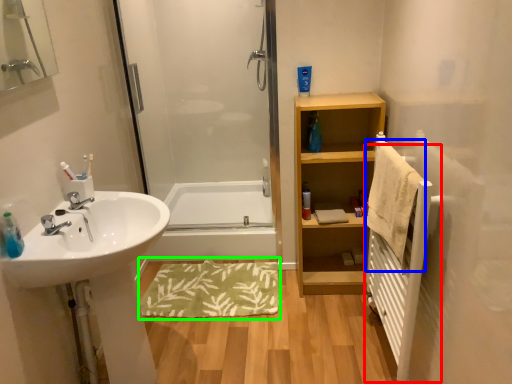
Question: Which object is the closest to the radiator (highlighted by a red box)? Choose among these: bath towel (highlighted by a blue box) or bath mat (highlighted by a green box).

Choices:
 (A) bath towel
 (B) bath mat

Answer: (A)